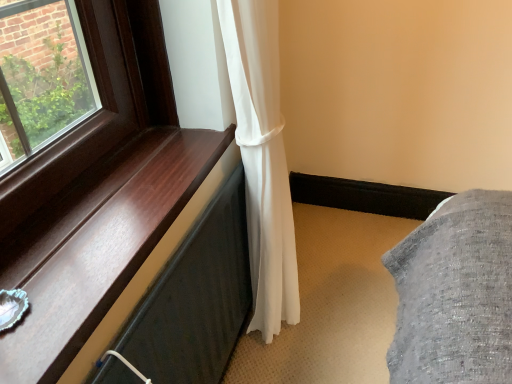
Question: Is shiny wood window sill at left inside the boundaries of white sheer curtain at center, or outside?

Choices:
 (A) outside
 (B) inside

Answer: (A)

Question: In terms of width, does shiny wood window sill at left look wider or thinner when compared to white sheer curtain at center?

Choices:
 (A) wide
 (B) thin

Answer: (A)

Question: Considering the positions of point (48, 324) and point (237, 82), is point (48, 324) closer or farther from the camera than point (237, 82)?

Choices:
 (A) farther
 (B) closer

Answer: (B)

Question: In the image, is white sheer curtain at center positioned in front of or behind shiny wood window sill at left?

Choices:
 (A) front
 (B) behind

Answer: (B)

Question: Is white sheer curtain at center to the left or to the right of shiny wood window sill at left in the image?

Choices:
 (A) left
 (B) right

Answer: (B)

Question: From their relative heights in the image, would you say white sheer curtain at center is taller or shorter than shiny wood window sill at left?

Choices:
 (A) tall
 (B) short

Answer: (A)

Question: In terms of width, does white sheer curtain at center look wider or thinner when compared to shiny wood window sill at left?

Choices:
 (A) wide
 (B) thin

Answer: (B)